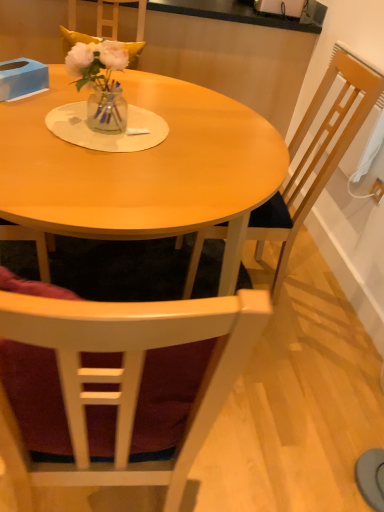
This screenshot has height=512, width=384. Identify the location of free point to the left of translucent glass vase at center. (47, 113).